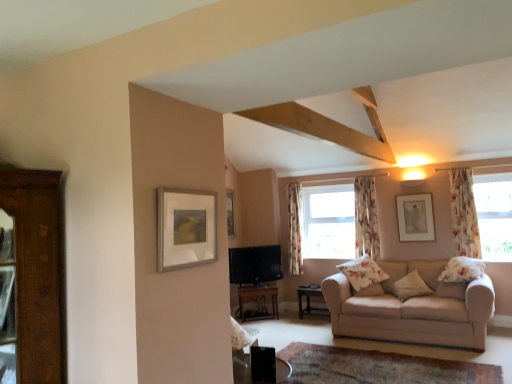
Question: Is beige fabric couch at lower right to the left or to the right of floral fabric curtain at right, the 3th curtain positioned from the back, in the image?

Choices:
 (A) left
 (B) right

Answer: (A)

Question: Is beige fabric couch at lower right taller or shorter than floral fabric curtain at right, the 3th curtain when ordered from left to right?

Choices:
 (A) short
 (B) tall

Answer: (A)

Question: Estimate the real-world distances between objects in this image. Which object is farther from the floral fabric curtain at right, the 1th curtain in the front-to-back sequence?

Choices:
 (A) floral fabric pillow at right, which is counted as the 3th pillow, starting from the left
 (B) matte black tv at center
 (C) floral fabric curtain at center, the 2th curtain from the left
 (D) clear glass window at center, acting as the second window starting from the front
 (E) matte silver picture frame at upper right, which ranks as the first picture frame in right-to-left order

Answer: (B)

Question: Which object is the farthest from the matte silver picture frame at upper right, positioned as the second picture frame in front-to-back order?

Choices:
 (A) wooden table at center, positioned as the 2th table in left-to-right order
 (B) wooden table at center, the second table from the right
 (C) matte silver picture frame at upper left, which is counted as the first picture frame, starting from the left
 (D) transparent floral curtains at upper right, the 1th window from the right
 (E) beige fabric couch at lower right

Answer: (C)